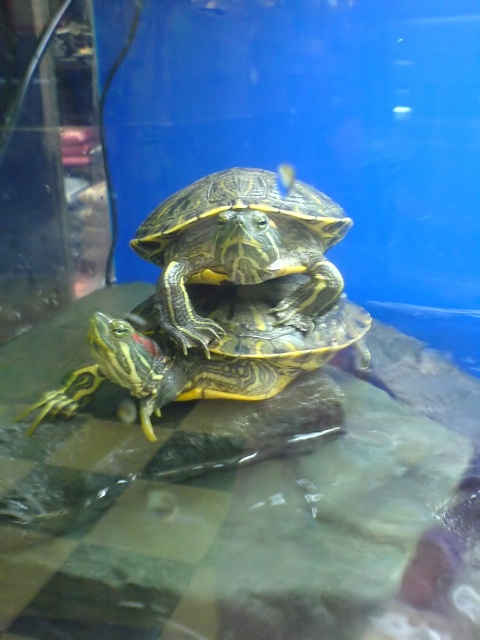
Between point (180, 305) and point (230, 328), which one is positioned behind?

Point (230, 328)

Does point (191, 282) come closer to viewer compared to point (363, 324)?

Yes, it is.

Does point (182, 346) come in front of point (296, 355)?

Yes, point (182, 346) is closer to viewer.

Where is `shiny green shell at center`? shiny green shell at center is located at coordinates (240, 248).